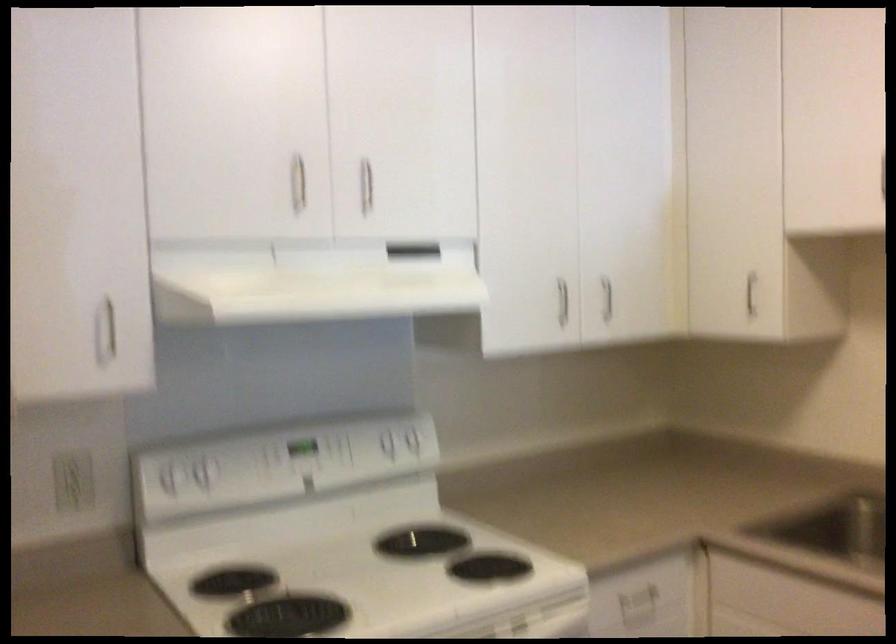
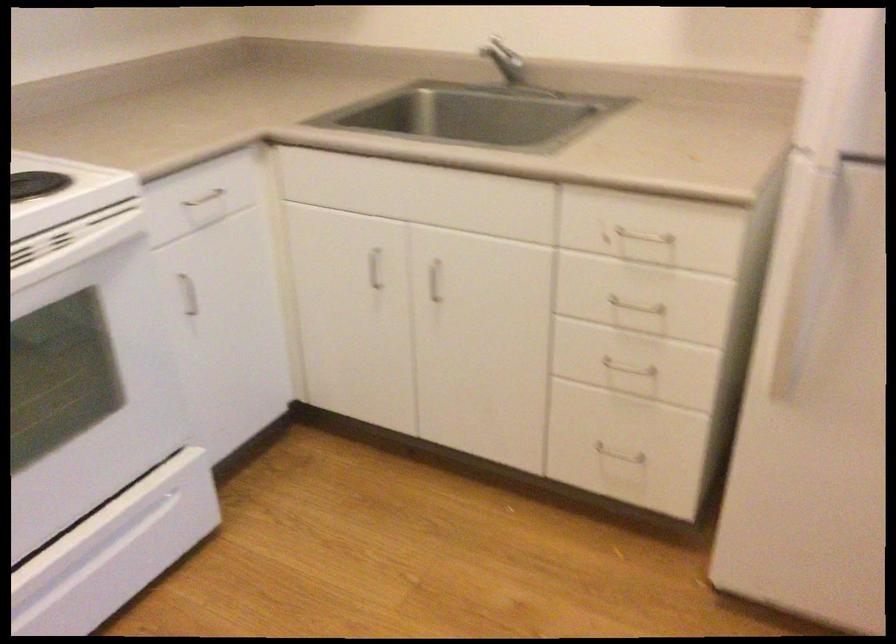
Based on the photo, the images are taken continuously from a first-person perspective. In which direction is your viewpoint rotating?

The camera's rotation is toward right-down.